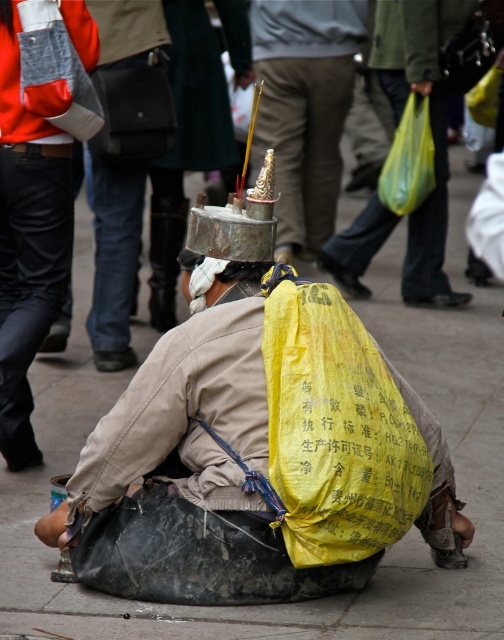
You are standing in the busy street scene and want to know which of the two points, point (367, 259) or point (202, 300), is closer to you. Can you determine this based on their positions?

Point (367, 259) is further to the viewer than point (202, 300), so point (202, 300) is closer to you.

You are a street performer who wants to balance a small object on the metallic gold incense burner at center. Considering the yellow fabric bag at lower center, which is narrower than the burner, can you place the object on the burner without it falling off?

The metallic gold incense burner at center is wider than the yellow fabric bag at lower center, so placing the object on the burner should be stable as it has a larger surface area to support it.

Looking at this image, based on the scene description, can you determine which object is larger between the metallic gold incense burner at center and the yellow fabric bag at lower center?

The metallic gold incense burner at center is bigger than the yellow fabric bag at lower center according to the description.